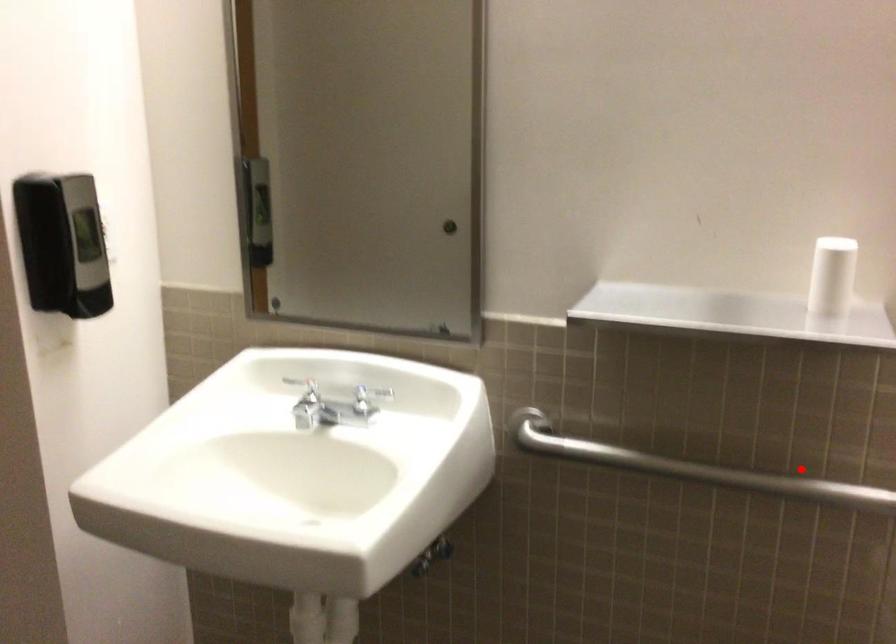
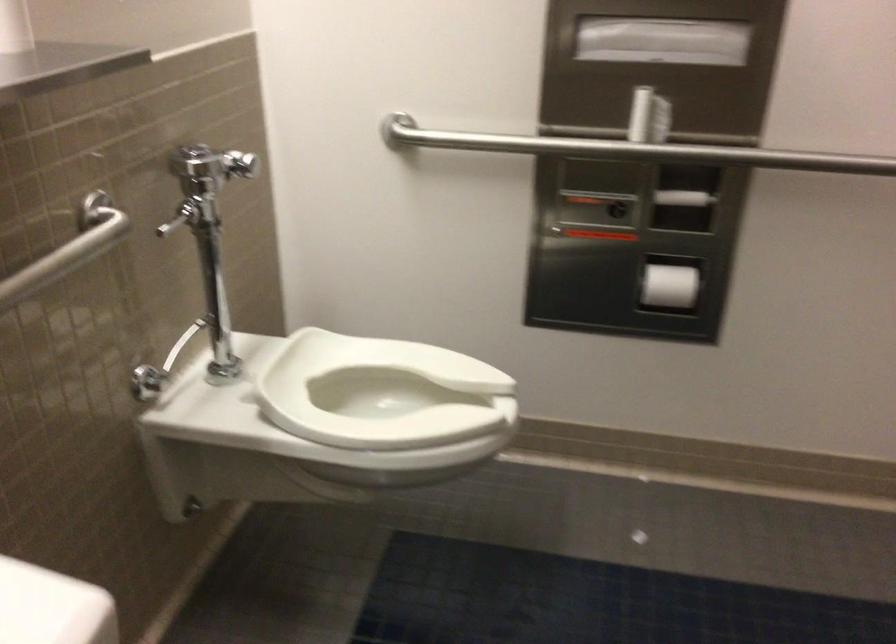
The point at the highlighted location is marked in the first image. Where is the corresponding point in the second image?

(67, 250)